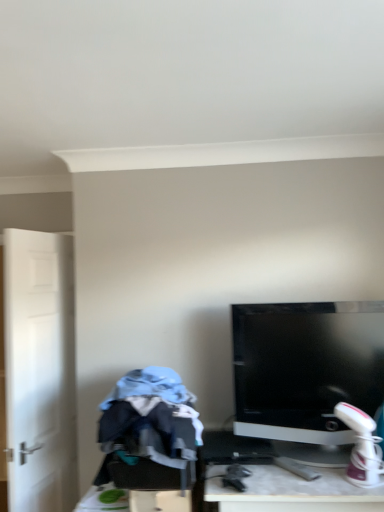
Question: From a real-world perspective, is blue cotton hoodie at left positioned under white matte door at left based on gravity?

Choices:
 (A) yes
 (B) no

Answer: (A)

Question: Is blue cotton hoodie at left closer to the viewer compared to white matte door at left?

Choices:
 (A) no
 (B) yes

Answer: (B)

Question: Does blue cotton hoodie at left have a smaller size compared to white matte door at left?

Choices:
 (A) no
 (B) yes

Answer: (B)

Question: Is blue cotton hoodie at left at the left side of white matte door at left?

Choices:
 (A) no
 (B) yes

Answer: (A)

Question: Does blue cotton hoodie at left have a greater height compared to white matte door at left?

Choices:
 (A) yes
 (B) no

Answer: (B)

Question: From a real-world perspective, relative to blue cotton hoodie at left, is white matte door at left vertically above or below?

Choices:
 (A) above
 (B) below

Answer: (A)

Question: Is white matte door at left to the left or to the right of blue cotton hoodie at left in the image?

Choices:
 (A) left
 (B) right

Answer: (A)

Question: In terms of width, does white matte door at left look wider or thinner when compared to blue cotton hoodie at left?

Choices:
 (A) thin
 (B) wide

Answer: (A)

Question: Is white matte door at left inside or outside of blue cotton hoodie at left?

Choices:
 (A) inside
 (B) outside

Answer: (B)

Question: From a real-world perspective, is blue cotton hoodie at left positioned above or below satin black monitor at center?

Choices:
 (A) below
 (B) above

Answer: (A)

Question: Is blue cotton hoodie at left wider or thinner than satin black monitor at center?

Choices:
 (A) wide
 (B) thin

Answer: (A)

Question: Looking at the image, does blue cotton hoodie at left seem bigger or smaller compared to satin black monitor at center?

Choices:
 (A) big
 (B) small

Answer: (B)

Question: Would you say blue cotton hoodie at left is inside or outside satin black monitor at center?

Choices:
 (A) inside
 (B) outside

Answer: (B)

Question: Would you say satin black monitor at center is to the left or to the right of white matte door at left in the picture?

Choices:
 (A) right
 (B) left

Answer: (A)

Question: In terms of width, does satin black monitor at center look wider or thinner when compared to white matte door at left?

Choices:
 (A) thin
 (B) wide

Answer: (B)